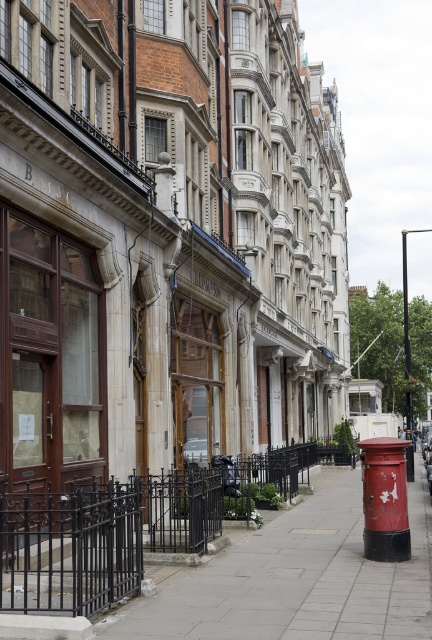
Is smooth concrete pavement at center further to the viewer compared to black wrought iron fence at lower center?

No, smooth concrete pavement at center is in front of black wrought iron fence at lower center.

Does smooth concrete pavement at center have a smaller size compared to black wrought iron fence at lower center?

Correct, smooth concrete pavement at center occupies less space than black wrought iron fence at lower center.

The image size is (432, 640). I want to click on smooth concrete pavement at center, so click(295, 579).